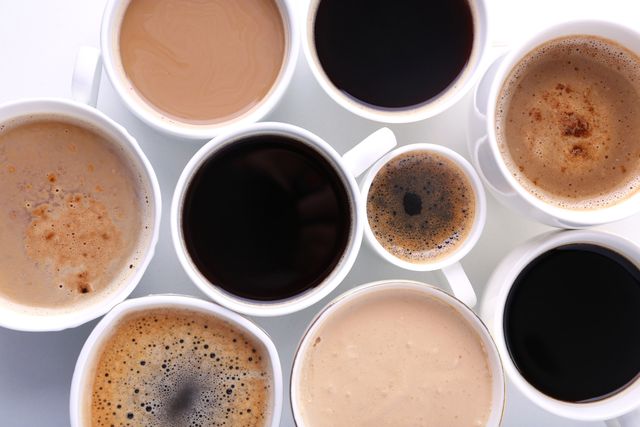
I want to click on white coffee mug, so click(x=77, y=394), click(x=44, y=330), click(x=265, y=312), click(x=310, y=336), click(x=529, y=395), click(x=477, y=235), click(x=518, y=196), click(x=475, y=64), click(x=268, y=105).